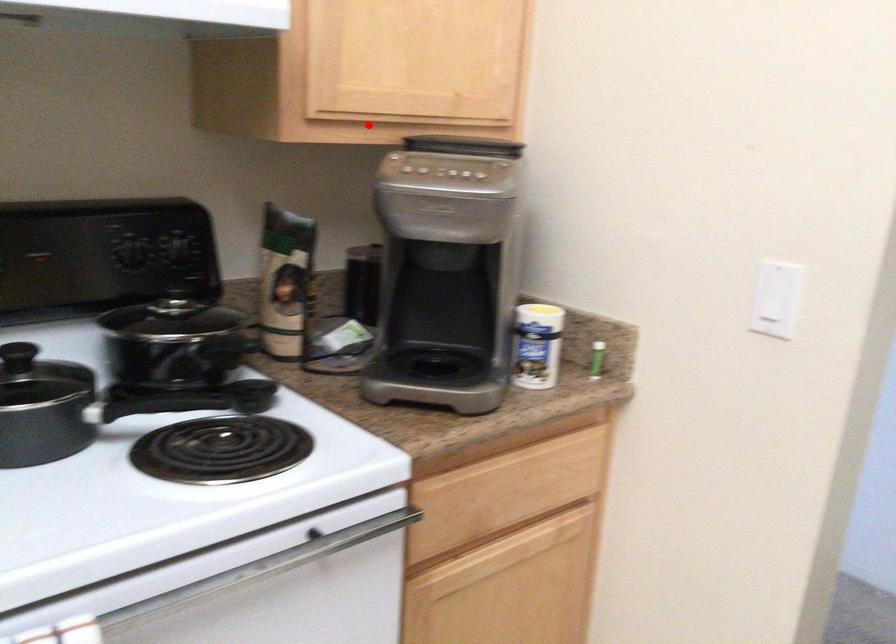
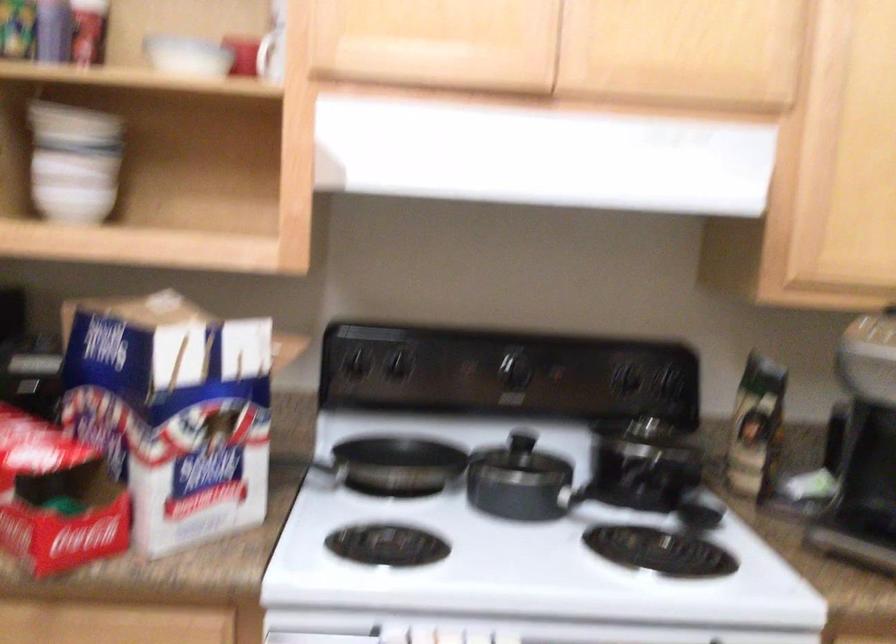
Question: I am providing you with two images of the same scene from different viewpoints. A red point is marked on the first image. At the location where the point appears in image 1, is it still visible in image 2?

Choices:
 (A) Yes
 (B) No

Answer: (A)